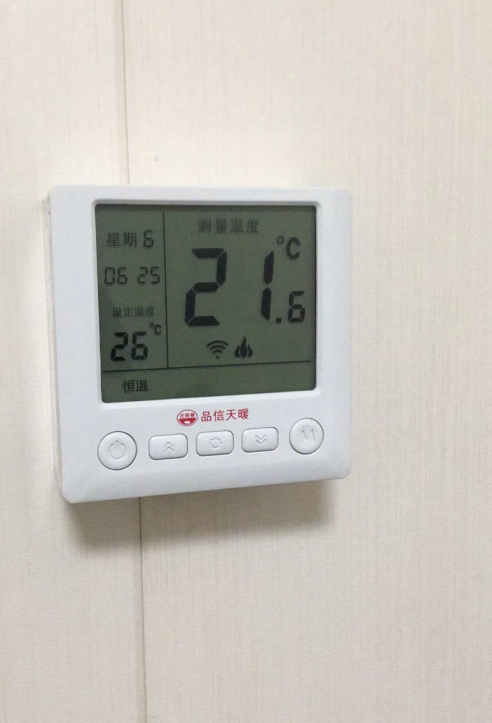
Where is `wall to right of thermostat`? The height and width of the screenshot is (723, 492). wall to right of thermostat is located at coordinates (356, 325).